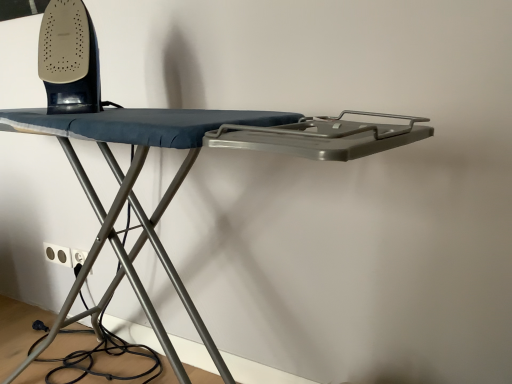
Question: From a real-world perspective, is white plastic electric outlet at lower left, acting as the second electric outlet starting from the left, positioned above or below matte black iron at upper left?

Choices:
 (A) below
 (B) above

Answer: (A)

Question: Is white plastic electric outlet at lower left, acting as the second electric outlet starting from the left, situated inside matte black iron at upper left or outside?

Choices:
 (A) inside
 (B) outside

Answer: (B)

Question: Estimate the real-world distances between objects in this image. Which object is closer to the white plastic electric outlet at lower left, the first electric outlet in the left-to-right sequence?

Choices:
 (A) matte black iron at upper left
 (B) white plastic electric outlet at lower left, acting as the second electric outlet starting from the left

Answer: (B)

Question: Which object is the closest to the matte black iron at upper left?

Choices:
 (A) white plastic electric outlet at lower left, which is the 2th electric outlet in right-to-left order
 (B) white plastic electric outlet at lower left, acting as the second electric outlet starting from the left

Answer: (B)